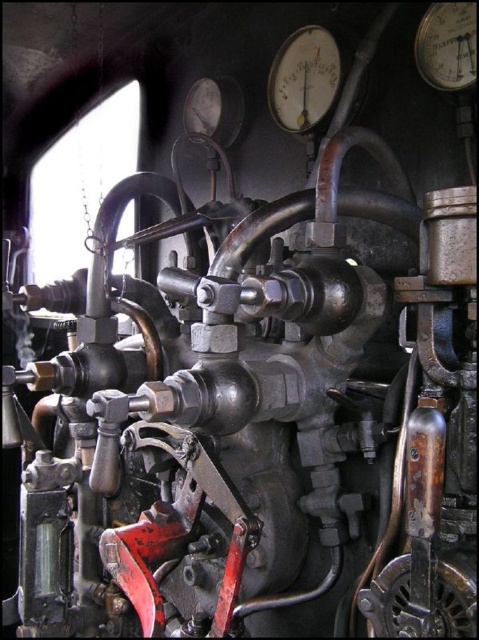
Question: Can you confirm if metallic gauge at upper center is thinner than metallic gauge at upper right?

Choices:
 (A) yes
 (B) no

Answer: (B)

Question: Is metallic gauge at upper center bigger than metallic gauge at upper right?

Choices:
 (A) yes
 (B) no

Answer: (A)

Question: Which point is farther to the camera?

Choices:
 (A) (417, 33)
 (B) (324, 35)

Answer: (B)

Question: Is metallic gauge at upper center smaller than metallic gauge at upper right?

Choices:
 (A) yes
 (B) no

Answer: (B)

Question: Which point is closer to the camera taking this photo?

Choices:
 (A) (444, 36)
 (B) (331, 72)

Answer: (A)